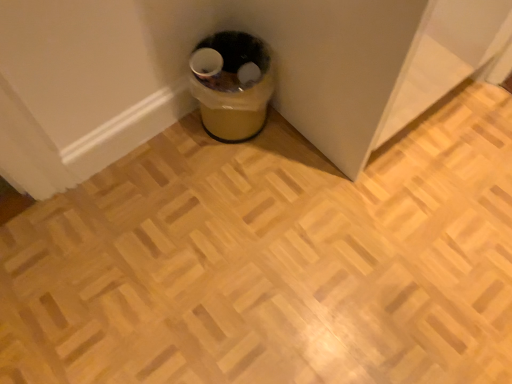
The image size is (512, 384). Find the location of `yellow plastic trash can at lower left`. yellow plastic trash can at lower left is located at coordinates click(x=232, y=84).

Describe the element at coordinates (232, 84) in the screenshot. The height and width of the screenshot is (384, 512). I see `yellow plastic trash can at lower left` at that location.

Locate an element on the screen. The image size is (512, 384). yellow plastic trash can at lower left is located at coordinates (232, 84).